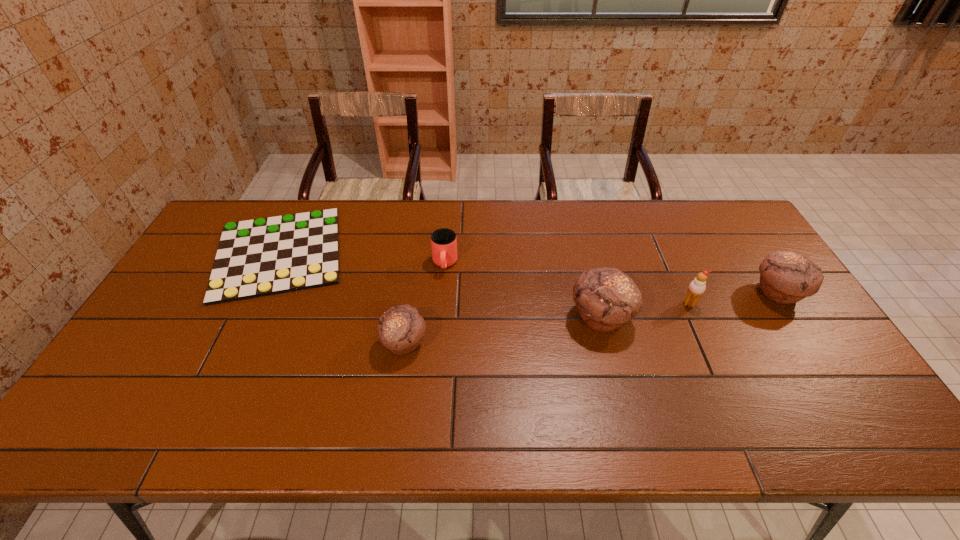
Identify the location of vacant region between the rightmost object and the leftmost object. (528, 273).

In order to click on vacant space in between the second object from right to left and the leftmost object in this screenshot , I will do `click(484, 278)`.

Identify the location of free space between the cup and the shortest muffin. This screenshot has height=540, width=960. (424, 303).

The width and height of the screenshot is (960, 540). What are the coordinates of `free spot between the second object from right to left and the shortest muffin` in the screenshot? It's located at (547, 323).

Image resolution: width=960 pixels, height=540 pixels. Identify the location of object that stands as the third closest to the leftmost muffin. (606, 298).

Locate which object ranks third in proximity to the cup. Please provide its 2D coordinates. Your answer should be formatted as a tuple, i.e. [(x, y)], where the tuple contains the x and y coordinates of a point satisfying the conditions above.

[(606, 298)]

Locate an element on the screen. muffin that is the second closest to the cup is located at coordinates (606, 298).

This screenshot has height=540, width=960. Find the location of `muffin that is the closest to the second muffin from left to right`. muffin that is the closest to the second muffin from left to right is located at coordinates (786, 277).

At what (x,y) coordinates should I click in order to perform the action: click on blank area in the image that satisfies the following two spatial constraints: 1. on the handle side of the second muffin from right to left; 2. on the right side of the cup. Please return your answer as a coordinate pair (x, y). The width and height of the screenshot is (960, 540). Looking at the image, I should click on (441, 317).

The image size is (960, 540). Find the location of `vacant space that satisfies the following two spatial constraints: 1. on the handle side of the second shortest muffin; 2. on the left side of the cup`. vacant space that satisfies the following two spatial constraints: 1. on the handle side of the second shortest muffin; 2. on the left side of the cup is located at coordinates (443, 293).